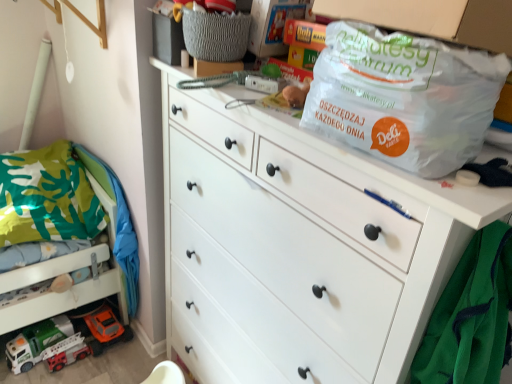
Question: Is transparent plastic bag at upper right further to camera compared to white matte chest of drawers at center?

Choices:
 (A) no
 (B) yes

Answer: (A)

Question: From the image's perspective, does transparent plastic bag at upper right appear higher than white matte chest of drawers at center?

Choices:
 (A) no
 (B) yes

Answer: (B)

Question: Considering the relative positions of transparent plastic bag at upper right and white matte chest of drawers at center in the image provided, is transparent plastic bag at upper right to the left of white matte chest of drawers at center from the viewer's perspective?

Choices:
 (A) yes
 (B) no

Answer: (B)

Question: Is transparent plastic bag at upper right not inside white matte chest of drawers at center?

Choices:
 (A) no
 (B) yes

Answer: (B)

Question: Is transparent plastic bag at upper right bigger than white matte chest of drawers at center?

Choices:
 (A) no
 (B) yes

Answer: (A)

Question: Is point (53, 312) closer or farther from the camera than point (238, 230)?

Choices:
 (A) farther
 (B) closer

Answer: (A)

Question: In terms of size, does green fabric bunk bed at lower left appear bigger or smaller than white matte chest of drawers at center?

Choices:
 (A) big
 (B) small

Answer: (B)

Question: In terms of width, does green fabric bunk bed at lower left look wider or thinner when compared to white matte chest of drawers at center?

Choices:
 (A) wide
 (B) thin

Answer: (A)

Question: From the image's perspective, is green fabric bunk bed at lower left positioned above or below white matte chest of drawers at center?

Choices:
 (A) below
 (B) above

Answer: (B)

Question: From a real-world perspective, relative to transparent plastic bag at upper right, is white matte chest of drawers at center vertically above or below?

Choices:
 (A) below
 (B) above

Answer: (A)

Question: In terms of height, does white matte chest of drawers at center look taller or shorter compared to transparent plastic bag at upper right?

Choices:
 (A) short
 (B) tall

Answer: (B)

Question: Is white matte chest of drawers at center inside or outside of transparent plastic bag at upper right?

Choices:
 (A) outside
 (B) inside

Answer: (A)

Question: Is white matte chest of drawers at center to the left or to the right of transparent plastic bag at upper right in the image?

Choices:
 (A) right
 (B) left

Answer: (B)

Question: In the image, is gray woven basket at upper center on the left side or the right side of transparent plastic bag at upper right?

Choices:
 (A) left
 (B) right

Answer: (A)

Question: Is gray woven basket at upper center taller or shorter than transparent plastic bag at upper right?

Choices:
 (A) tall
 (B) short

Answer: (B)